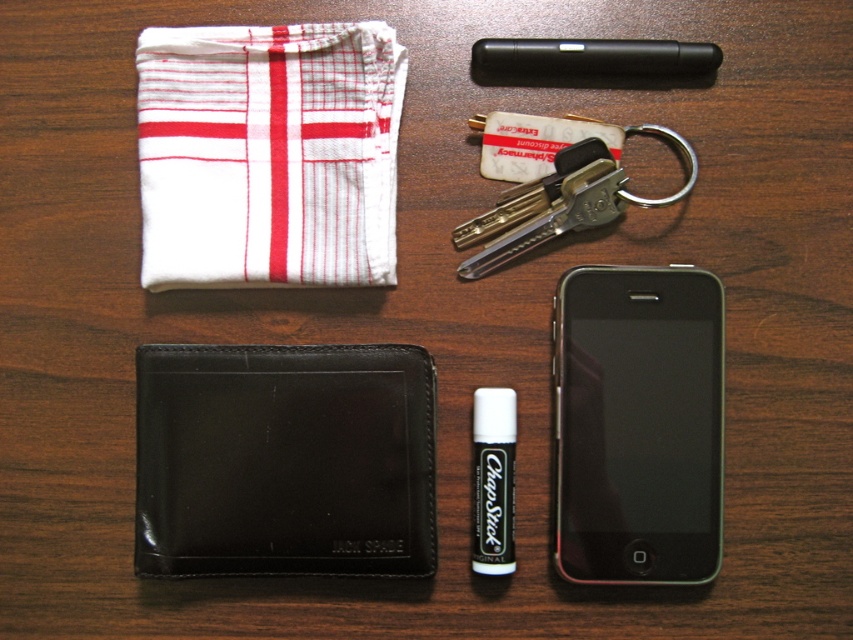
Does metallic silver keys at upper center have a larger size compared to black plastic pen at upper center?

Correct, metallic silver keys at upper center is larger in size than black plastic pen at upper center.

Can you confirm if metallic silver keys at upper center is positioned to the right of black plastic pen at upper center?

In fact, metallic silver keys at upper center is to the left of black plastic pen at upper center.

Who is more forward, (582, 163) or (694, 58)?

Point (694, 58) is in front.

Find the location of a particular element. The image size is (853, 640). metallic silver keys at upper center is located at coordinates (560, 202).

Is white woven cloth at upper left above black matte smartphone at lower right?

Yes.

Can you confirm if white woven cloth at upper left is bigger than black matte smartphone at lower right?

Indeed, white woven cloth at upper left has a larger size compared to black matte smartphone at lower right.

Which is in front, point (270, 141) or point (643, 320)?

Point (270, 141) is in front.

You are a GUI agent. You are given a task and a screenshot of the screen. Output one action in this format:
    pyautogui.click(x=<x>, y=<y>)
    Task: Click on the white woven cloth at upper left
    
    Given the screenshot: What is the action you would take?
    pyautogui.click(x=268, y=154)

Between black leather wallet at lower left and metallic silver keys at upper center, which one has less height?

metallic silver keys at upper center

Image resolution: width=853 pixels, height=640 pixels. Describe the element at coordinates (283, 460) in the screenshot. I see `black leather wallet at lower left` at that location.

Identify the location of black leather wallet at lower left. The height and width of the screenshot is (640, 853). (283, 460).